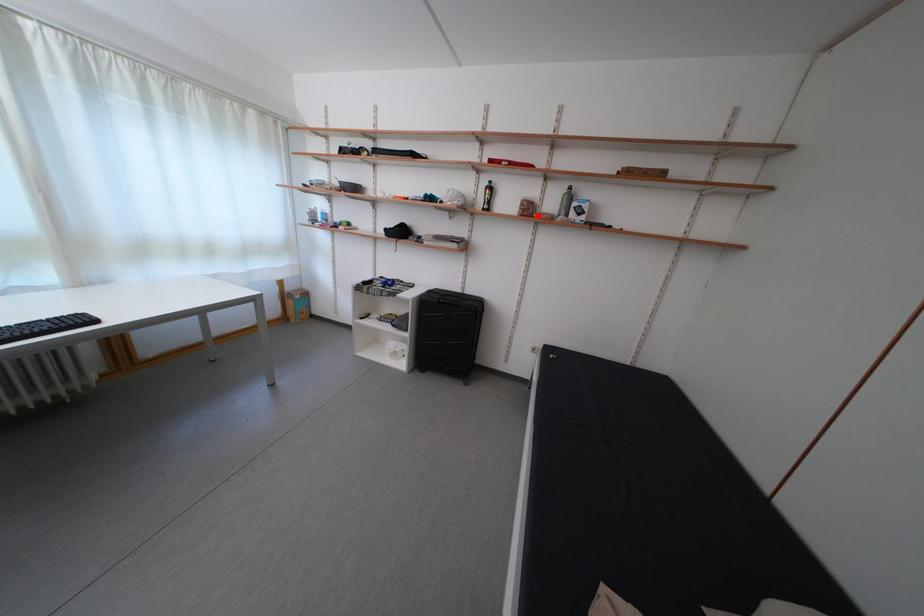
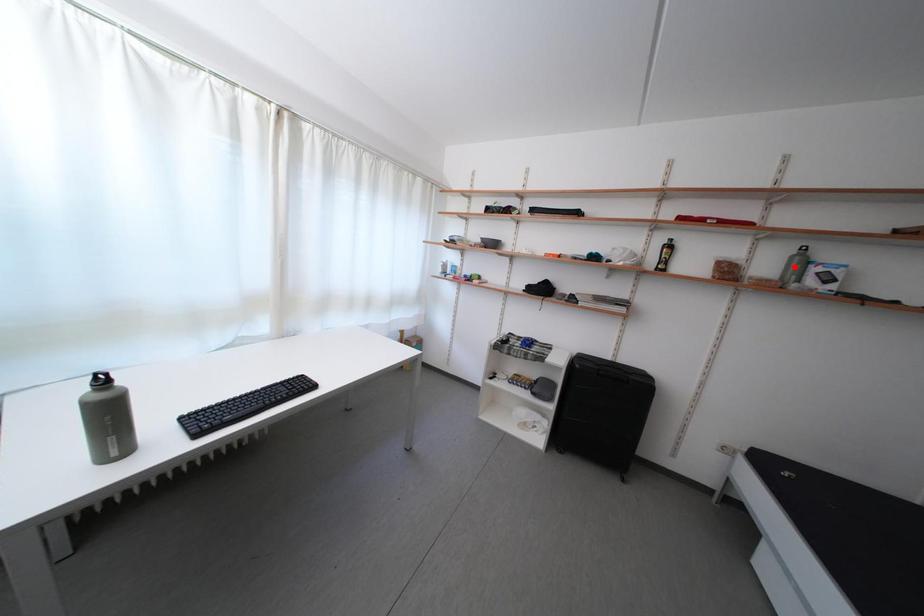
I am providing you with two images of the same scene from different viewpoints. A red point is marked on the first image and another point is marked on the second image. Is the red point in image1 aligned with the point shown in image2?

No